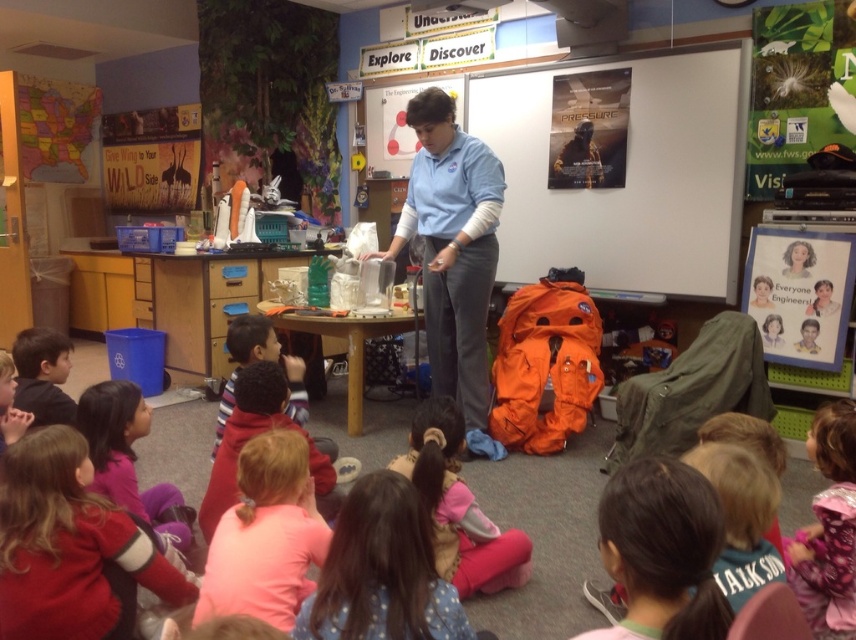
Question: Is light brown hair at center to the left of fluffy pink dress at lower right from the viewer's perspective?

Choices:
 (A) yes
 (B) no

Answer: (A)

Question: Which of the following is the farthest from the observer?

Choices:
 (A) pink fabric at lower center
 (B) dark brown hair at lower left
 (C) light blue shirt at center

Answer: (C)

Question: Can you confirm if light blue shirt at center is bigger than dark brown hair at lower right?

Choices:
 (A) yes
 (B) no

Answer: (A)

Question: Which of these objects is positioned farthest from the fluffy pink dress at lower right?

Choices:
 (A) red fleece jacket at lower left
 (B) light blue shirt at center
 (C) dark brown hair at lower left

Answer: (C)

Question: Which object is farther from the camera taking this photo?

Choices:
 (A) dark brown hair at lower left
 (B) red fleece jacket at lower left
 (C) pink fleece jacket at lower center
 (D) light brown hair at center

Answer: (A)

Question: Is matte poster at upper right closer to the viewer compared to pink fabric at lower center?

Choices:
 (A) yes
 (B) no

Answer: (B)